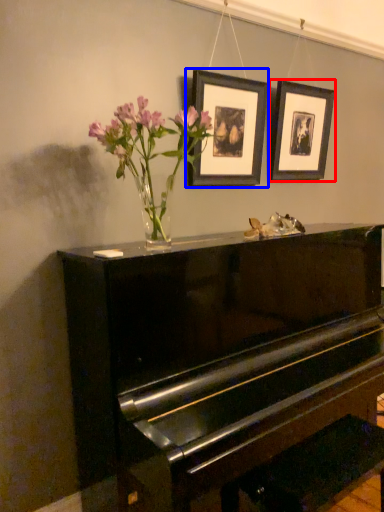
Question: Among these objects, which one is nearest to the camera, picture frame (highlighted by a red box) or picture frame (highlighted by a blue box)?

Choices:
 (A) picture frame
 (B) picture frame

Answer: (B)